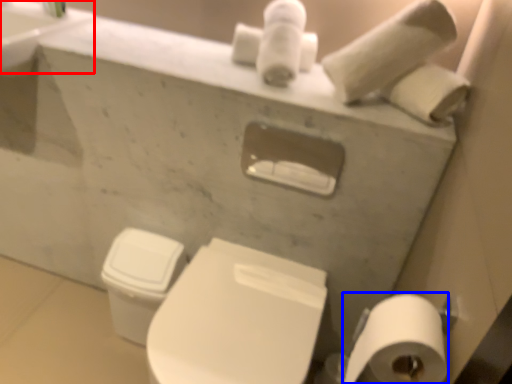
Question: Which of the following is the farthest to the observer, sink (highlighted by a red box) or toilet paper (highlighted by a blue box)?

Choices:
 (A) sink
 (B) toilet paper

Answer: (A)